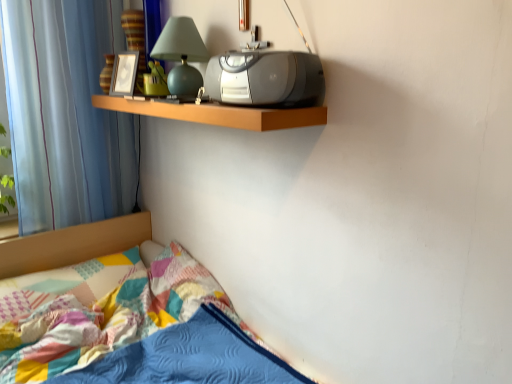
Question: Considering the relative positions of matte green glass table lamp at upper center and wooden shelf at upper center in the image provided, is matte green glass table lamp at upper center to the left of wooden shelf at upper center from the viewer's perspective?

Choices:
 (A) no
 (B) yes

Answer: (B)

Question: Is matte green glass table lamp at upper center not close to wooden shelf at upper center?

Choices:
 (A) no
 (B) yes

Answer: (A)

Question: Can you confirm if matte green glass table lamp at upper center is taller than wooden shelf at upper center?

Choices:
 (A) no
 (B) yes

Answer: (B)

Question: Is wooden shelf at upper center at the back of matte green glass table lamp at upper center?

Choices:
 (A) yes
 (B) no

Answer: (B)

Question: Can you confirm if matte green glass table lamp at upper center is wider than wooden shelf at upper center?

Choices:
 (A) no
 (B) yes

Answer: (A)

Question: Is the depth of matte green glass table lamp at upper center less than that of wooden shelf at upper center?

Choices:
 (A) no
 (B) yes

Answer: (A)

Question: Can you confirm if blue sheer curtain at left is positioned to the right of textured cotton quilt at lower left?

Choices:
 (A) yes
 (B) no

Answer: (B)

Question: Is blue sheer curtain at left next to textured cotton quilt at lower left and touching it?

Choices:
 (A) no
 (B) yes

Answer: (A)

Question: Does blue sheer curtain at left have a lesser height compared to textured cotton quilt at lower left?

Choices:
 (A) no
 (B) yes

Answer: (A)

Question: Can we say blue sheer curtain at left lies outside textured cotton quilt at lower left?

Choices:
 (A) yes
 (B) no

Answer: (A)

Question: From the image's perspective, is blue sheer curtain at left above textured cotton quilt at lower left?

Choices:
 (A) yes
 (B) no

Answer: (A)

Question: Does blue sheer curtain at left contain textured cotton quilt at lower left?

Choices:
 (A) yes
 (B) no

Answer: (B)

Question: Does matte green glass table lamp at upper center have a lesser width compared to green rubber duck at upper center?

Choices:
 (A) no
 (B) yes

Answer: (A)